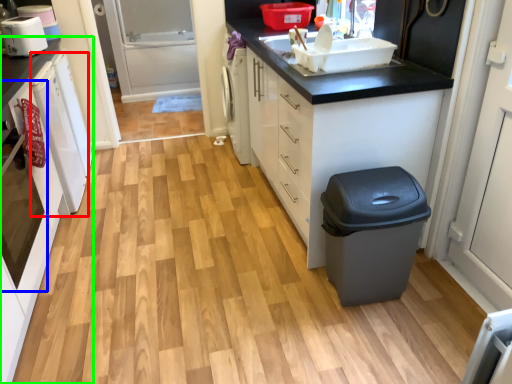
Question: Based on their relative distances, which object is nearer to dish washer (highlighted by a red box)? Choose from oven (highlighted by a blue box) and cabinetry (highlighted by a green box).

Choices:
 (A) oven
 (B) cabinetry

Answer: (B)